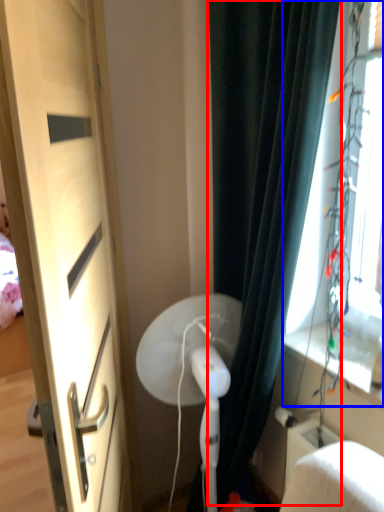
Question: Which point is closer to the camera, curtain (highlighted by a red box) or window screen (highlighted by a blue box)?

Choices:
 (A) curtain
 (B) window screen

Answer: (B)